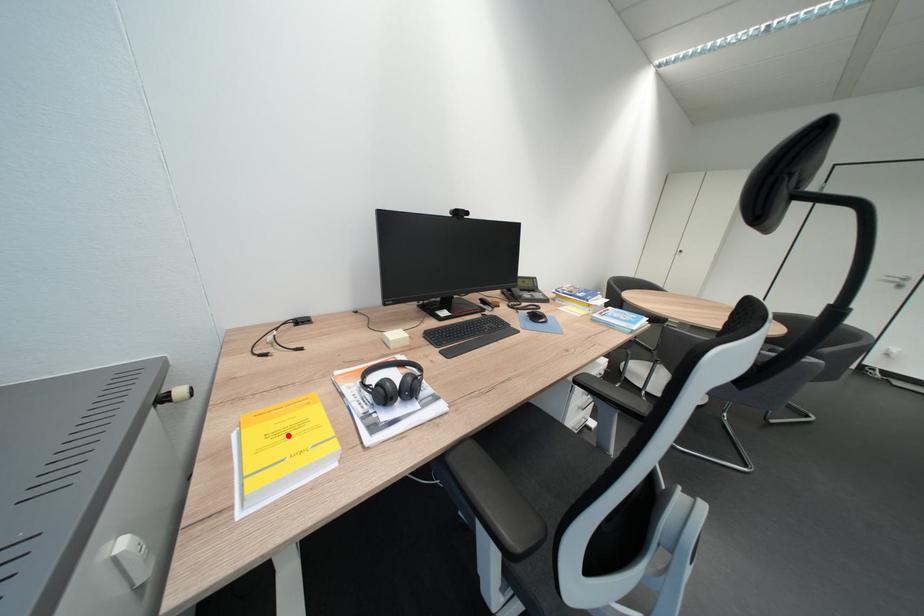
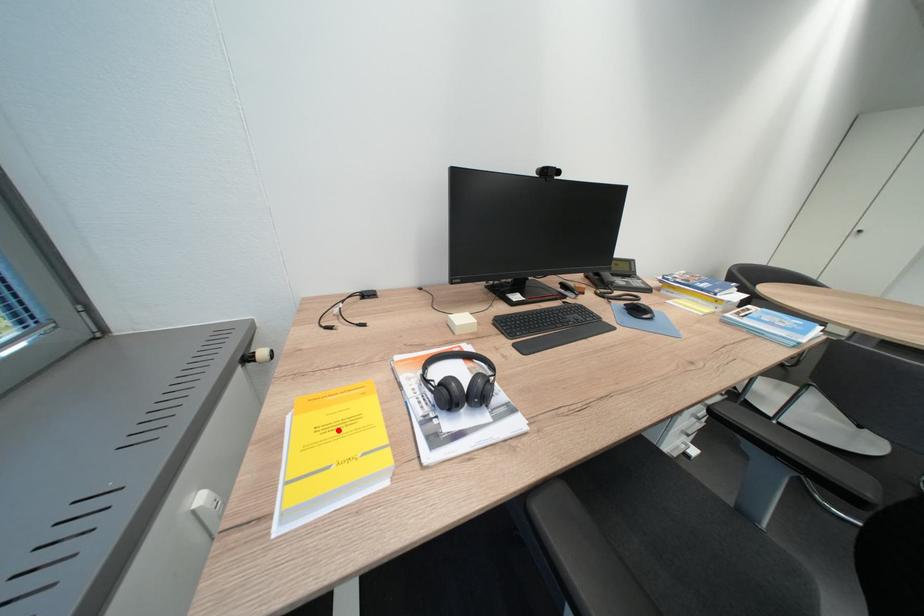
I am providing you with two images of the same scene from different viewpoints. A red point is marked on the first image and another point is marked on the second image. Do the highlighted points in image1 and image2 indicate the same real-world spot?

Yes